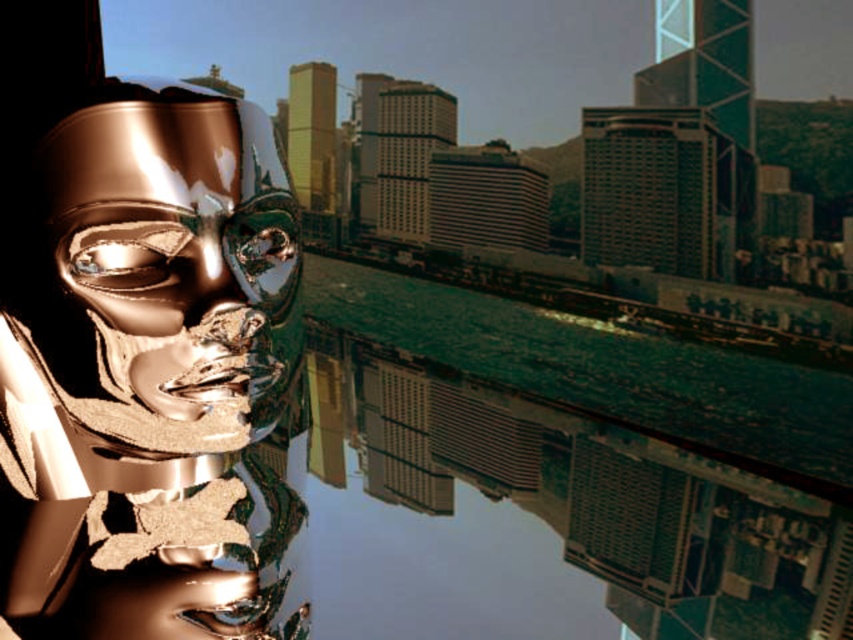
You are a drone operator trying to capture the reflection of the city skyline in the green reflective water at center. According to the coordinates provided, where should you position your drone to ensure it captures the reflection properly?

The green reflective water at center is located at coordinates point (x=543, y=476), so positioning the drone at that point would ensure it captures the reflection of the city skyline properly.

You are an artist trying to paint the scene. You need to decide the placement of the green reflective water at center and the shiny gold mask at center. Based on the scene description, which object is positioned lower in the image?

The green reflective water at center is located below the shiny gold mask at center, so the green reflective water at center is positioned lower in the image.